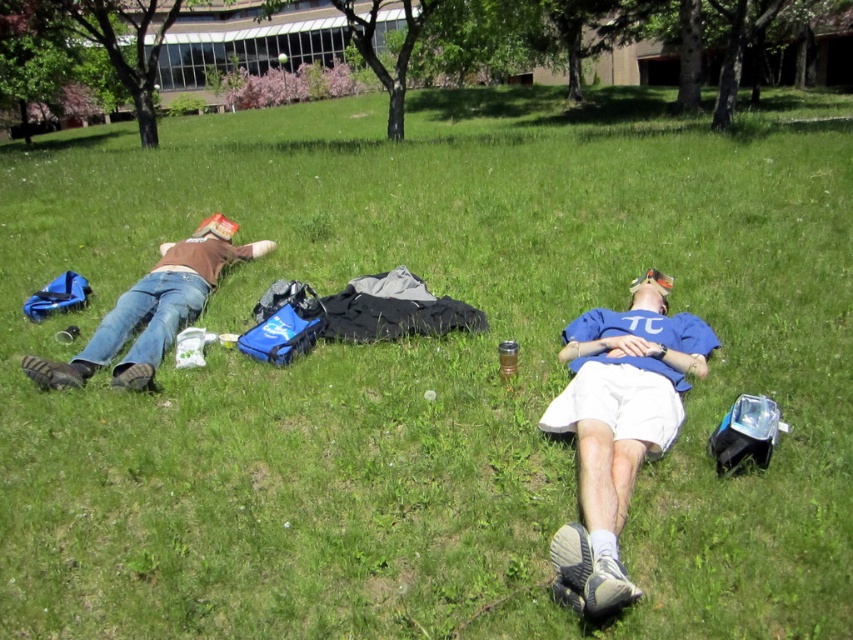
Looking at this image, is blue cotton shirt at center below brown matte shirt at left?

Yes, blue cotton shirt at center is below brown matte shirt at left.

Who is lower down, blue cotton shirt at center or brown matte shirt at left?

Positioned lower is blue cotton shirt at center.

Is point (698, 362) positioned before point (126, 337)?

That is True.

Where is `blue cotton shirt at center`? The width and height of the screenshot is (853, 640). blue cotton shirt at center is located at coordinates (618, 428).